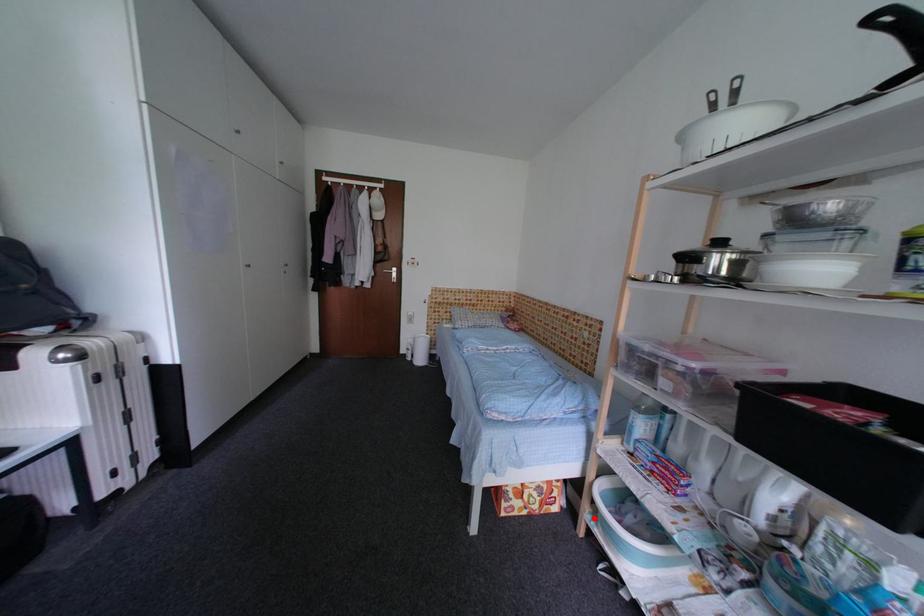
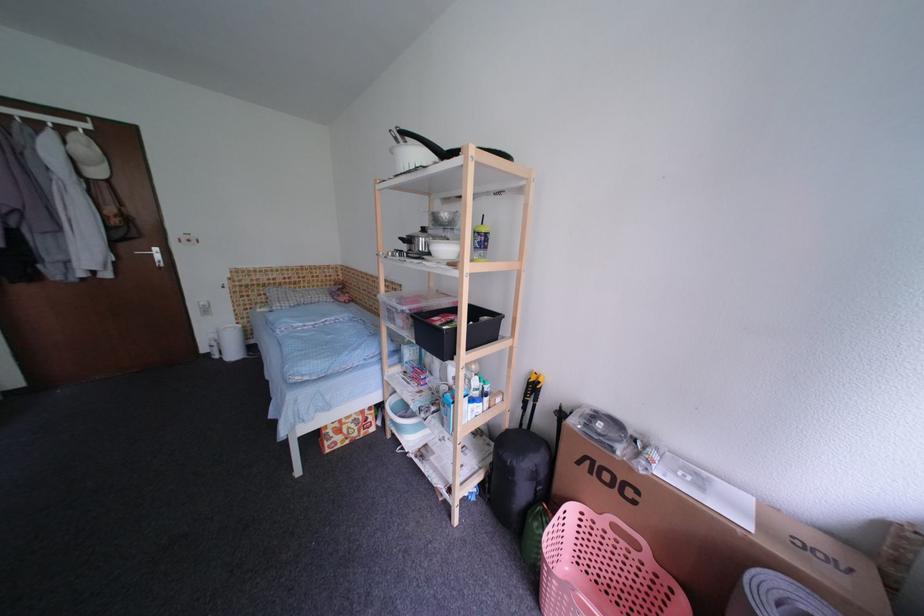
Question: I am providing you with two images of the same scene from different viewpoints. A red point is shown in image1. For the corresponding object point in image2, is it positioned nearer or farther from the camera?

Choices:
 (A) Nearer
 (B) Farther

Answer: (B)